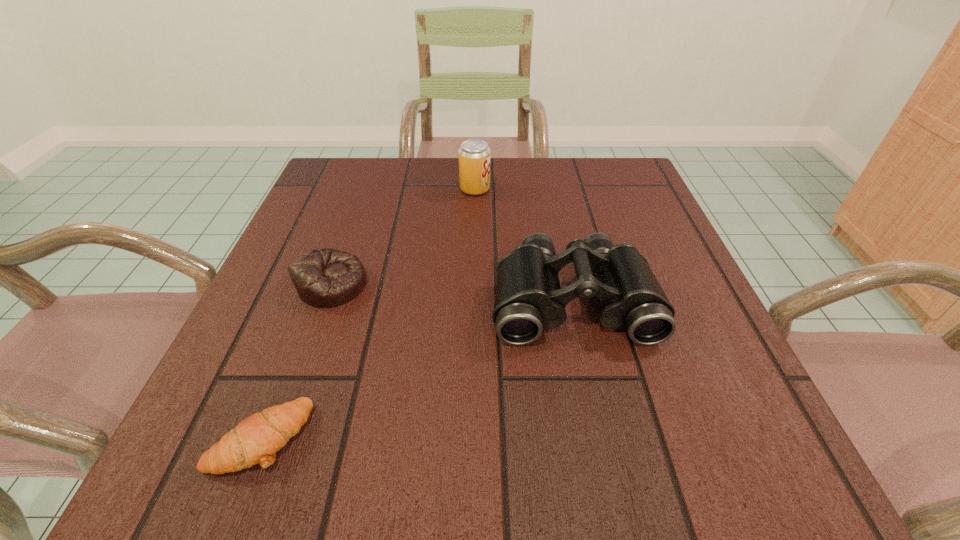
Locate an element on the screen. Image resolution: width=960 pixels, height=540 pixels. pop (soda) is located at coordinates (474, 155).

This screenshot has width=960, height=540. I want to click on binoculars, so click(x=528, y=298).

Identify the location of the second shortest object. (324, 278).

Identify the location of crescent roll. The height and width of the screenshot is (540, 960). click(x=256, y=439).

Find the location of `the nearest object`. the nearest object is located at coordinates (256, 439).

Locate an element on the screen. The height and width of the screenshot is (540, 960). vacant space situated 0.120m on the front of the farthest object is located at coordinates (474, 228).

Locate an element on the screen. The image size is (960, 540). vacant region located on the front of the second shortest object is located at coordinates (306, 356).

Where is `vacant space located 0.350m on the right of the nearest object`? Image resolution: width=960 pixels, height=540 pixels. vacant space located 0.350m on the right of the nearest object is located at coordinates (569, 437).

At what (x,y) coordinates should I click in order to perform the action: click on object located in the far edge section of the desktop. Please return your answer as a coordinate pair (x, y). The height and width of the screenshot is (540, 960). Looking at the image, I should click on (474, 155).

At what (x,y) coordinates should I click in order to perform the action: click on object positioned at the near edge. Please return your answer as a coordinate pair (x, y). The height and width of the screenshot is (540, 960). Looking at the image, I should click on (256, 439).